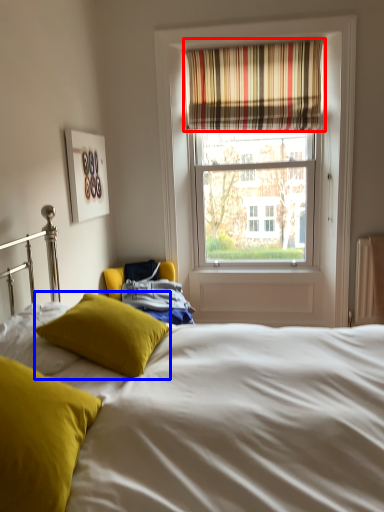
Question: Which of the following is the closest to the observer, curtain (highlighted by a red box) or pillow (highlighted by a blue box)?

Choices:
 (A) curtain
 (B) pillow

Answer: (B)